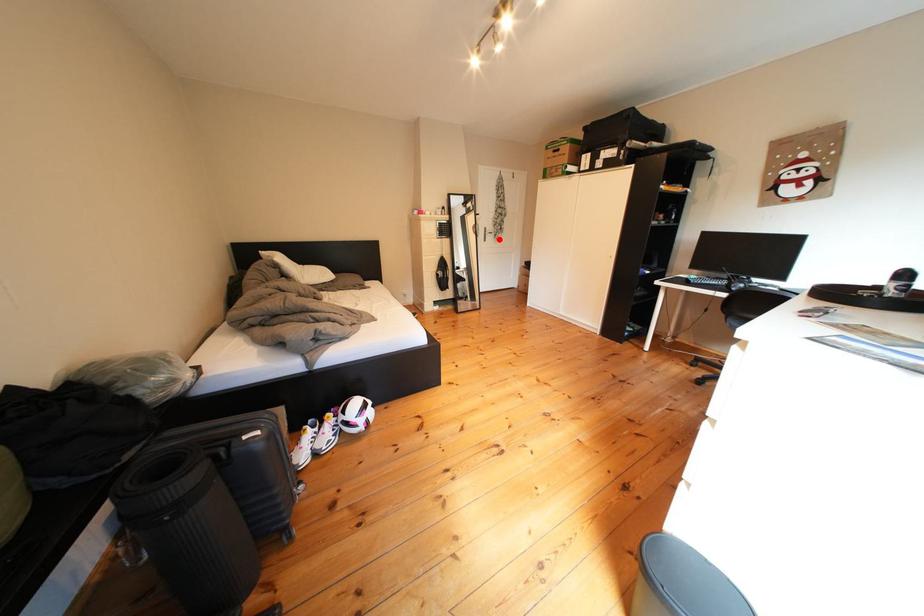
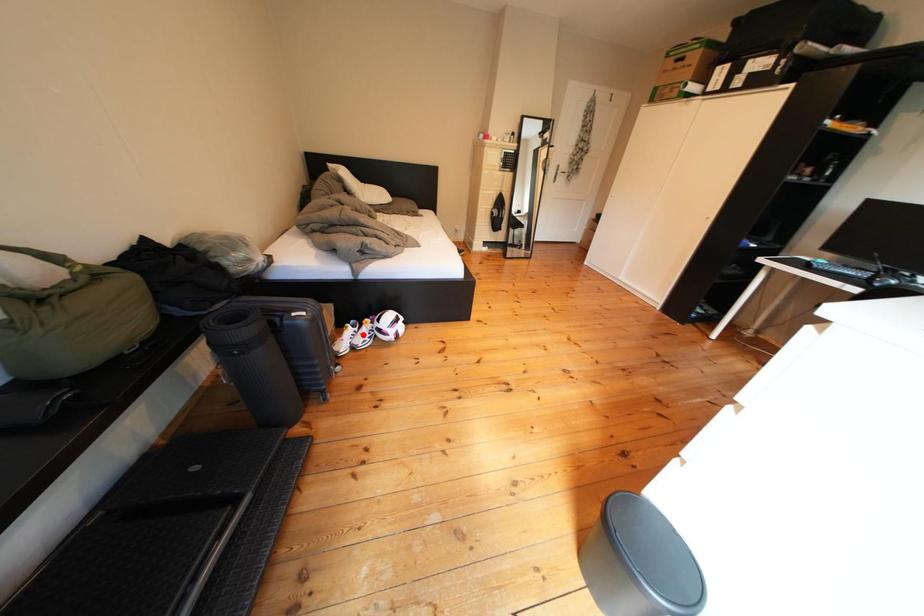
I am providing you with two images of the same scene from different viewpoints. A red point is marked on the first image and another point is marked on the second image. Does the point marked in image1 correspond to the same location as the one in image2?

No